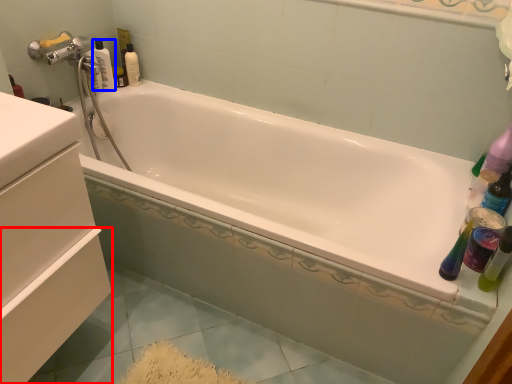
Question: Which object is further to the camera taking this photo, drawer (highlighted by a red box) or bottle (highlighted by a blue box)?

Choices:
 (A) drawer
 (B) bottle

Answer: (B)